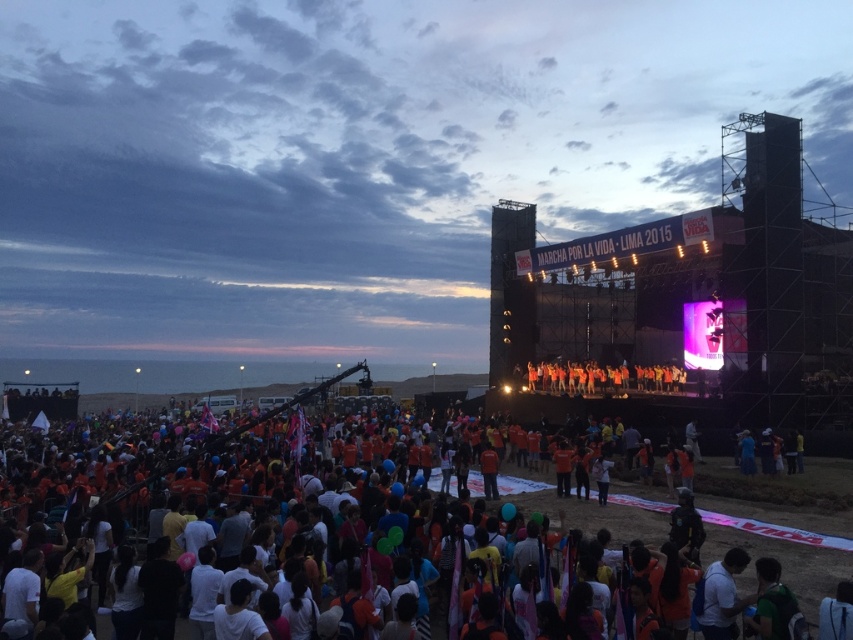
Question: Which point is farther from the camera taking this photo?

Choices:
 (A) (549, 392)
 (B) (440, 595)

Answer: (A)

Question: Where is orange t-shirts at lower center located in relation to orange fabric people at center in the image?

Choices:
 (A) below
 (B) above

Answer: (A)

Question: Can you confirm if orange t-shirts at lower center is thinner than orange fabric people at center?

Choices:
 (A) yes
 (B) no

Answer: (B)

Question: Does orange t-shirts at lower center have a greater width compared to orange fabric people at center?

Choices:
 (A) no
 (B) yes

Answer: (B)